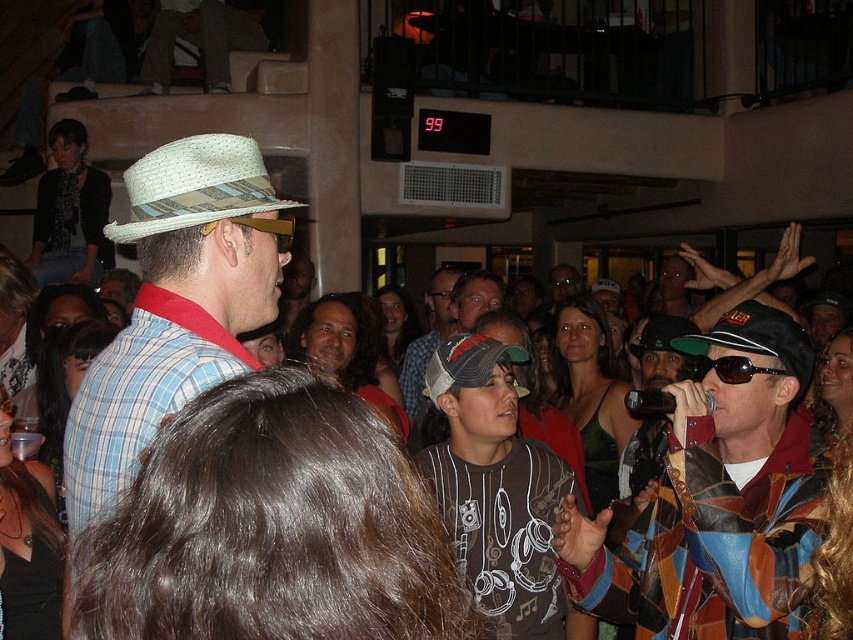
Is matte straw hat at upper left smaller than denim cap at center?

Incorrect, matte straw hat at upper left is not smaller in size than denim cap at center.

Image resolution: width=853 pixels, height=640 pixels. Identify the location of matte straw hat at upper left. 70,212.

Between light blue plaid shirt at center and black fabric cap at center, which one appears on the left side from the viewer's perspective?

light blue plaid shirt at center is more to the left.

Is point (231, 141) closer to viewer compared to point (790, 337)?

Yes.

What are the coordinates of `light blue plaid shirt at center` in the screenshot? It's located at (177, 305).

Is light blue plaid shirt at center below dark brown t-shirt at center?

Incorrect, light blue plaid shirt at center is not positioned below dark brown t-shirt at center.

Who is more distant from viewer, (209, 308) or (541, 564)?

The point (541, 564) is behind.

Is point (215, 154) positioned in front of point (474, 588)?

Yes.

What are the coordinates of `light blue plaid shirt at center` in the screenshot? It's located at (177, 305).